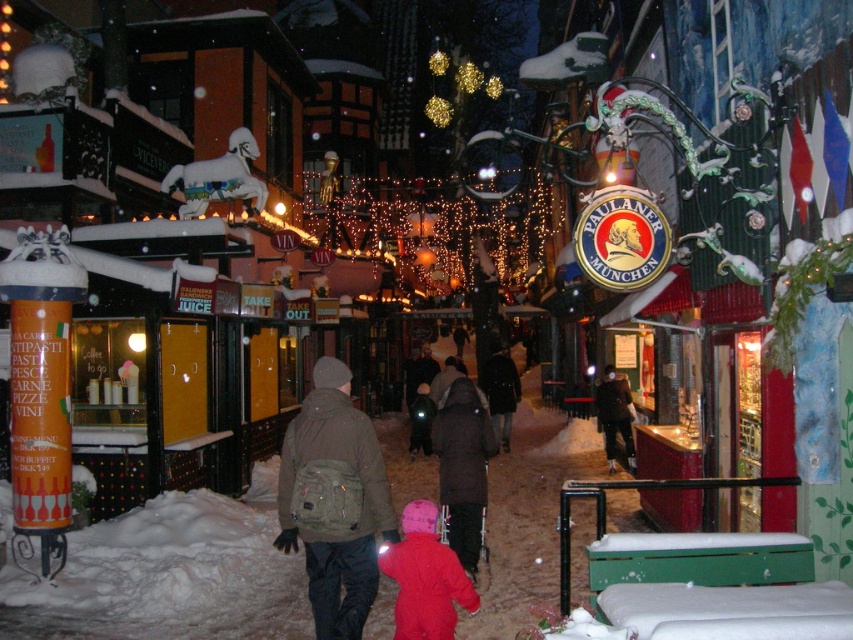
You are standing at the point closest to the camera in this winter scene. There are two points marked in the image, one at coordinates point (292, 452) and another at point (404, 625). Which of these points is farther away from your current position?

Point (292, 452) is behind point (404, 625), so it is farther away from your current position.

You are a photographer trying to capture both the matte pink snowsuit at lower center and the dark brown coat at center in a single frame. Which clothing item will appear smaller in the photo?

The matte pink snowsuit at lower center will appear smaller in the photo because it has a smaller size compared to the dark brown coat at center.

You are standing in the winter street scene and need to reach a nearby bench located 10 feet away from both the olive green backpack at center and the dark brown coat at center. Can you determine which object is closer to the bench?

The olive green backpack at center is 9.71 feet from dark brown coat at center. Since the bench is 10 feet away from both objects, the olive green backpack at center is slightly closer to the bench than the dark brown coat at center because it is only 9.71 feet away from the coat, making it 0.29 feet closer to the bench.